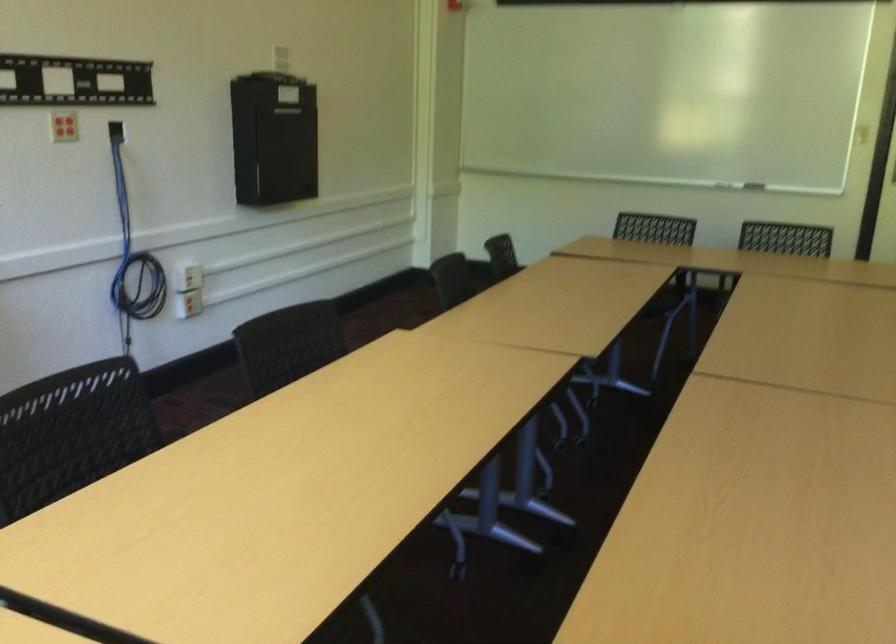
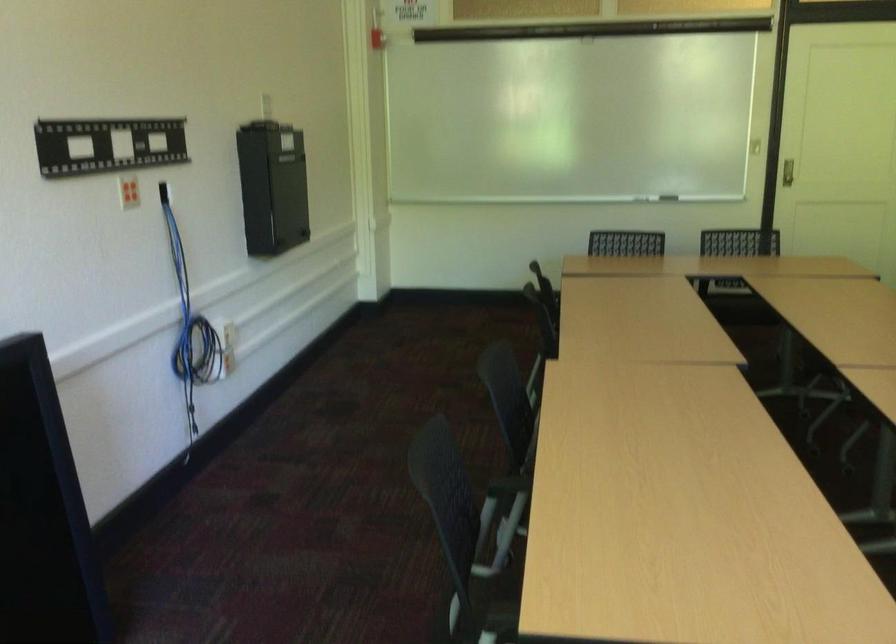
Locate, in the second image, the point that corresponds to pixel 218 442 in the first image.

(506, 486)